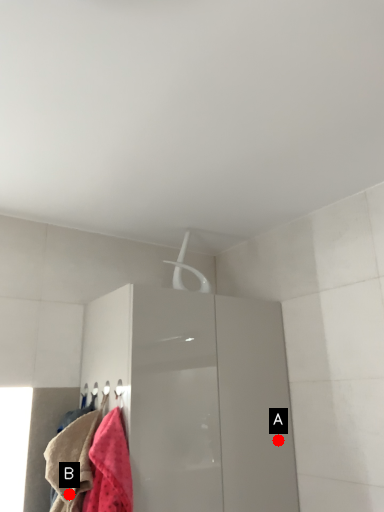
Question: Two points are circled on the image, labeled by A and B beside each circle. Which point is farther to the camera?

Choices:
 (A) A is further
 (B) B is further

Answer: (A)